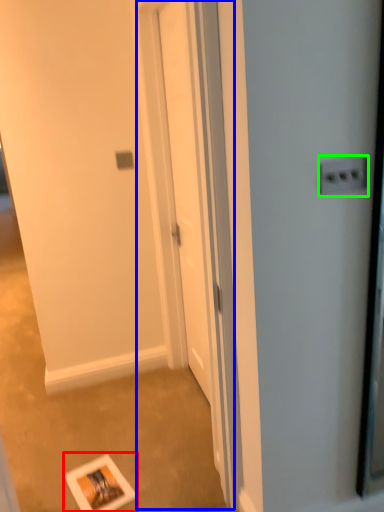
Question: Estimate the real-world distances between objects in this image. Which object is closer to postcard (highlighted by a red box), screen door (highlighted by a blue box) or electric outlet (highlighted by a green box)?

Choices:
 (A) screen door
 (B) electric outlet

Answer: (A)